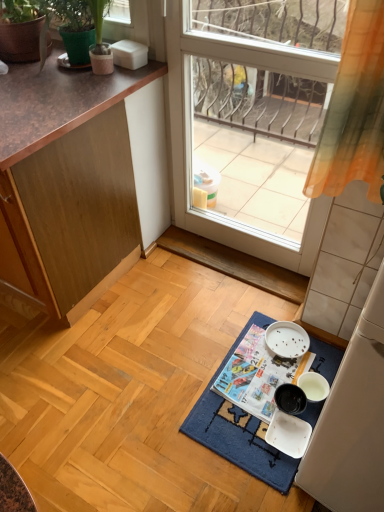
Identify the location of vacant space behind white plastic bowl at lower right. (268, 382).